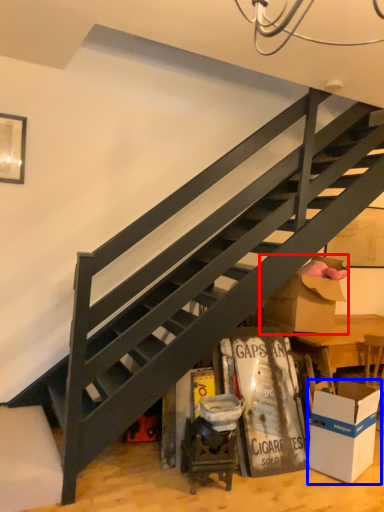
Question: Which of the following is the closest to the observer, cardboard box (highlighted by a red box) or box (highlighted by a blue box)?

Choices:
 (A) cardboard box
 (B) box

Answer: (B)